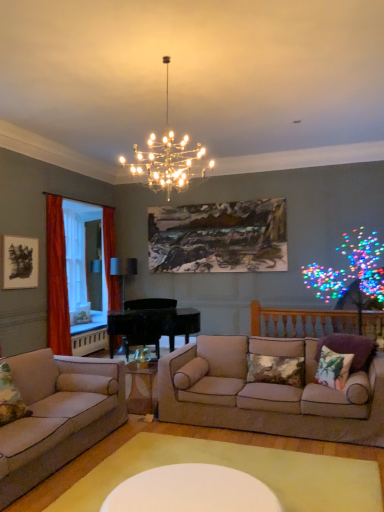
Question: Is beige fabric couch at lower left, which ranks as the 1th studio couch in left-to-right order, not within beige fabric couch at center, marked as the 2th studio couch in a left-to-right arrangement?

Choices:
 (A) no
 (B) yes

Answer: (B)

Question: Does beige fabric couch at lower left, which appears as the 2th studio couch when viewed from the right, have a greater width compared to beige fabric couch at center, marked as the 2th studio couch in a left-to-right arrangement?

Choices:
 (A) yes
 (B) no

Answer: (A)

Question: Is beige fabric couch at lower left, which appears as the 2th studio couch when viewed from the right, positioned in front of beige fabric couch at center, which ranks as the first studio couch in right-to-left order?

Choices:
 (A) no
 (B) yes

Answer: (B)

Question: Could beige fabric couch at center, which ranks as the first studio couch in right-to-left order, be considered to be inside beige fabric couch at lower left, which ranks as the 1th studio couch in left-to-right order?

Choices:
 (A) yes
 (B) no

Answer: (B)

Question: Is beige fabric couch at lower left, which ranks as the 1th studio couch in left-to-right order, positioned behind beige fabric couch at center, which ranks as the first studio couch in right-to-left order?

Choices:
 (A) yes
 (B) no

Answer: (B)

Question: From a real-world perspective, is beige fabric couch at lower left, which ranks as the 1th studio couch in left-to-right order, beneath beige fabric couch at center, marked as the 2th studio couch in a left-to-right arrangement?

Choices:
 (A) no
 (B) yes

Answer: (B)

Question: From the image's perspective, is velvet orange curtain at left, the 2th curtain when ordered from right to left, above metallic chandelier at upper center, positioned as the 2th lamp in back-to-front order?

Choices:
 (A) yes
 (B) no

Answer: (B)

Question: Is velvet orange curtain at left, the 2th curtain when ordered from right to left, at the right side of metallic chandelier at upper center, positioned as the 2th lamp in back-to-front order?

Choices:
 (A) no
 (B) yes

Answer: (A)

Question: Is velvet orange curtain at left, which appears as the second curtain when viewed from the back, directly adjacent to metallic chandelier at upper center, acting as the first lamp starting from the top?

Choices:
 (A) yes
 (B) no

Answer: (B)

Question: Is velvet orange curtain at left, the 2th curtain when ordered from right to left, smaller than metallic chandelier at upper center, acting as the first lamp starting from the top?

Choices:
 (A) no
 (B) yes

Answer: (B)

Question: Is metallic chandelier at upper center, the second lamp viewed from the left, inside velvet orange curtain at left, the 2th curtain when ordered from right to left?

Choices:
 (A) yes
 (B) no

Answer: (B)

Question: Is velvet orange curtain at left, which is the first curtain from left to right, not inside metallic chandelier at upper center, positioned as the 2th lamp in back-to-front order?

Choices:
 (A) yes
 (B) no

Answer: (A)

Question: From a real-world perspective, is floral fabric pillow at right, placed as the second pillow when sorted from left to right, over translucent fabric curtain at left, the 1th window screen when ordered from front to back?

Choices:
 (A) no
 (B) yes

Answer: (A)